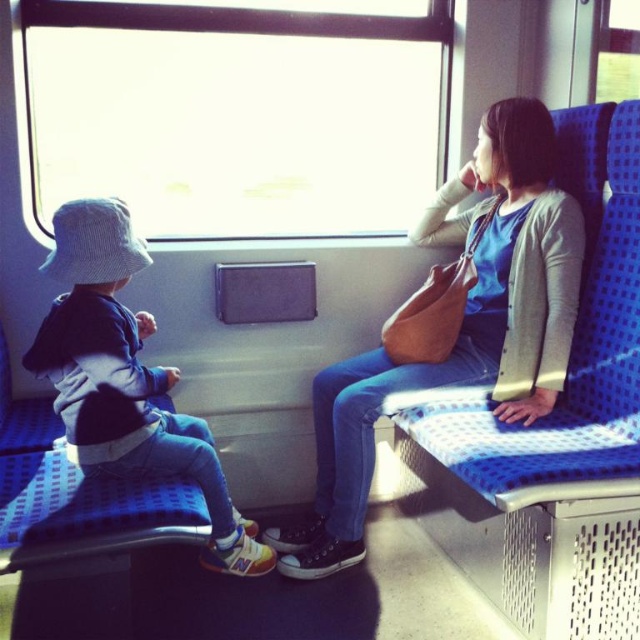
Is transparent glass window at upper center thinner than denim pants at left?

Incorrect, transparent glass window at upper center's width is not less than denim pants at left's.

Identify the location of transparent glass window at upper center. The height and width of the screenshot is (640, 640). (236, 115).

Is transparent glass window at upper center to the right of matte brown purse at center from the viewer's perspective?

In fact, transparent glass window at upper center is to the left of matte brown purse at center.

Can you confirm if transparent glass window at upper center is smaller than matte brown purse at center?

No.

I want to click on transparent glass window at upper center, so click(236, 115).

Identify the location of transparent glass window at upper center. (236, 115).

Between point (317, 476) and point (58, 236), which one is positioned in front?

Point (58, 236) is in front.

Is point (477, 321) behind point (148, 440)?

Yes, it is.

Measure the distance between point (516, 266) and camera.

A distance of 1.98 meters exists between point (516, 266) and camera.

The image size is (640, 640). In order to click on matte brown purse at center in this screenshot , I will do `click(460, 326)`.